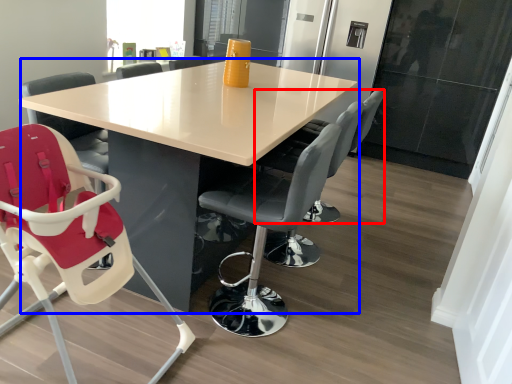
Question: Which object appears closest to the camera in this image, chair (highlighted by a red box) or table (highlighted by a blue box)?

Choices:
 (A) chair
 (B) table

Answer: (B)